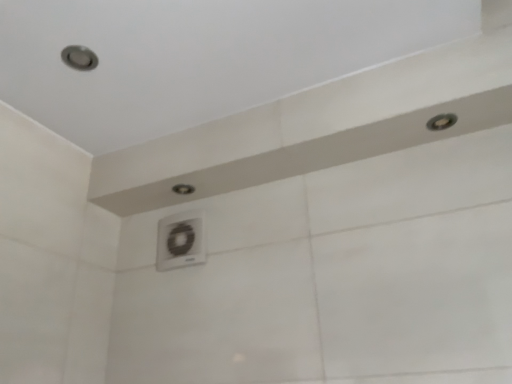
Question: From a real-world perspective, is white plastic air conditioner at center physically located above or below matte white shower at center, positioned as the 1th shower in left-to-right order?

Choices:
 (A) above
 (B) below

Answer: (B)

Question: Is point (181, 228) positioned closer to the camera than point (182, 183)?

Choices:
 (A) farther
 (B) closer

Answer: (A)

Question: Estimate the real-world distances between objects in this image. Which object is closer to the matte white shower at center, the second shower in the front-to-back sequence?

Choices:
 (A) matte silver shower at upper right, the first shower from the front
 (B) white plastic air conditioner at center

Answer: (B)

Question: Which object is the closest to the matte white shower at center, which is the first shower from back to front?

Choices:
 (A) white plastic air conditioner at center
 (B) matte silver shower at upper right, the first shower from the front

Answer: (A)